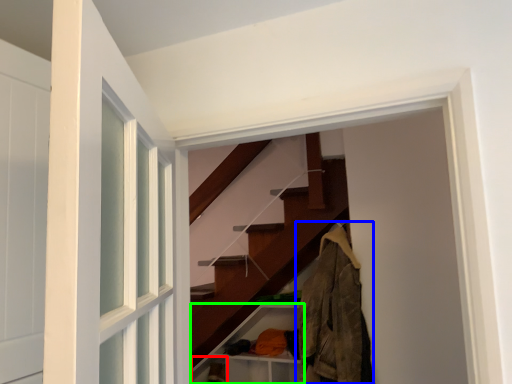
Question: Which is nearer to the shelf (highlighted by a red box)? clothing (highlighted by a blue box) or cabinet (highlighted by a green box).

Choices:
 (A) clothing
 (B) cabinet

Answer: (B)